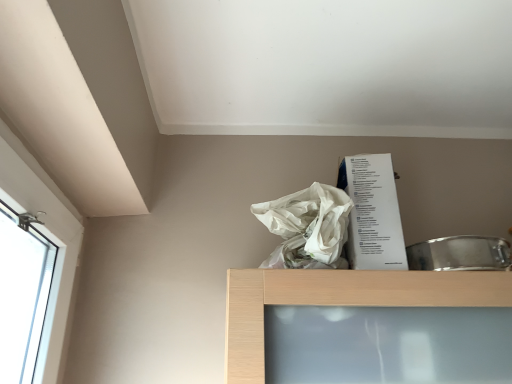
What is the approximate height of white plastic bag at upper center?

6.41 inches.

Find the location of `white plastic bag at upper center`. white plastic bag at upper center is located at coordinates (307, 227).

Measure the distance between white plastic bag at upper center and camera.

The distance of white plastic bag at upper center from camera is 72.41 centimeters.

The height and width of the screenshot is (384, 512). Describe the element at coordinates (307, 227) in the screenshot. I see `white plastic bag at upper center` at that location.

What do you see at coordinates (372, 213) in the screenshot?
I see `white paper at upper center` at bounding box center [372, 213].

The width and height of the screenshot is (512, 384). I want to click on white paper at upper center, so click(372, 213).

Measure the distance between white paper at upper center and camera.

white paper at upper center and camera are 31.86 inches apart from each other.

Identify the location of white plastic bag at upper center. This screenshot has height=384, width=512. (x=307, y=227).

Can you confirm if white paper at upper center is positioned to the right of white plastic bag at upper center?

Yes.

In the scene shown: Considering the positions of objects white paper at upper center and white plastic bag at upper center in the image provided, who is in front, white paper at upper center or white plastic bag at upper center?

Positioned in front is white plastic bag at upper center.

Considering the positions of points (360, 164) and (341, 216), is point (360, 164) closer to camera compared to point (341, 216)?

No, (360, 164) is further to viewer.

From the image's perspective, is white paper at upper center beneath white plastic bag at upper center?

Yes.

From a real-world perspective, is white paper at upper center above or below white plastic bag at upper center?

white paper at upper center is above white plastic bag at upper center.

From the picture: Is white paper at upper center wider than white plastic bag at upper center?

Correct, the width of white paper at upper center exceeds that of white plastic bag at upper center.

Who is shorter, white paper at upper center or white plastic bag at upper center?

Standing shorter between the two is white plastic bag at upper center.

Can you confirm if white paper at upper center is smaller than white plastic bag at upper center?

No.

Is white plastic bag at upper center located within white paper at upper center?

That's incorrect, white plastic bag at upper center is not inside white paper at upper center.

Is white paper at upper center not near white plastic bag at upper center?

No.

Is white paper at upper center oriented towards white plastic bag at upper center?

No, white paper at upper center is not turned towards white plastic bag at upper center.

What's the angular difference between white paper at upper center and white plastic bag at upper center's facing directions?

The angle between the facing direction of white paper at upper center and the facing direction of white plastic bag at upper center is 0.00313 degrees.

I want to click on paperback book on the right side of white plastic bag at upper center, so click(372, 213).

Consider the image. Is white plastic bag at upper center at the left side of white paper at upper center?

Indeed, white plastic bag at upper center is positioned on the left side of white paper at upper center.

Considering their positions, is white plastic bag at upper center located in front of or behind white paper at upper center?

Visually, white plastic bag at upper center is located in front of white paper at upper center.

Is point (327, 255) positioned in front of point (402, 259)?

Yes.

From the image's perspective, is white plastic bag at upper center located beneath white paper at upper center?

Actually, white plastic bag at upper center appears above white paper at upper center in the image.

From a real-world perspective, is white plastic bag at upper center over white paper at upper center?

Actually, white plastic bag at upper center is physically below white paper at upper center in the real world.

Considering the relative sizes of white plastic bag at upper center and white paper at upper center in the image provided, is white plastic bag at upper center thinner than white paper at upper center?

Correct, the width of white plastic bag at upper center is less than that of white paper at upper center.

Can you confirm if white plastic bag at upper center is taller than white paper at upper center?

Incorrect, the height of white plastic bag at upper center is not larger of that of white paper at upper center.

Looking at the image, does white plastic bag at upper center seem bigger or smaller compared to white paper at upper center?

white plastic bag at upper center is smaller than white paper at upper center.

Would you say white plastic bag at upper center contains white paper at upper center?

No, white paper at upper center is not a part of white plastic bag at upper center.

Is white plastic bag at upper center positioned far away from white paper at upper center?

white plastic bag at upper center is actually quite close to white paper at upper center.

Is white plastic bag at upper center facing towards white paper at upper center?

No, white plastic bag at upper center is not turned towards white paper at upper center.

How many degrees apart are the facing directions of white plastic bag at upper center and white paper at upper center?

They differ by 0.00313 degrees in their facing directions.

This screenshot has height=384, width=512. Identify the location of paperback book located behind the white plastic bag at upper center. (372, 213).

Where is `paperback book lying behind the white plastic bag at upper center`? This screenshot has width=512, height=384. paperback book lying behind the white plastic bag at upper center is located at coordinates (372, 213).

At what (x,y) coordinates should I click in order to perform the action: click on plastic bag that appears below the white paper at upper center (from a real-world perspective). Please return your answer as a coordinate pair (x, y). Looking at the image, I should click on (307, 227).